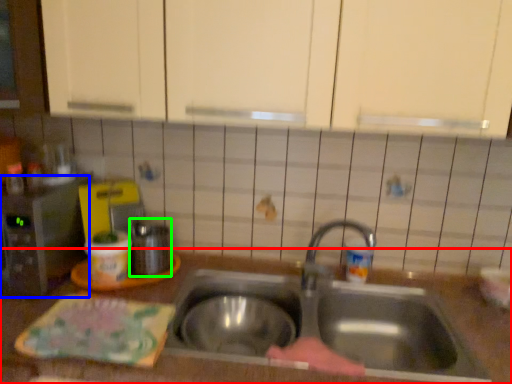
Question: Which object is positioned farthest from countertop (highlighted by a red box)? Select from appliance (highlighted by a blue box) and appliance (highlighted by a green box).

Choices:
 (A) appliance
 (B) appliance

Answer: (B)